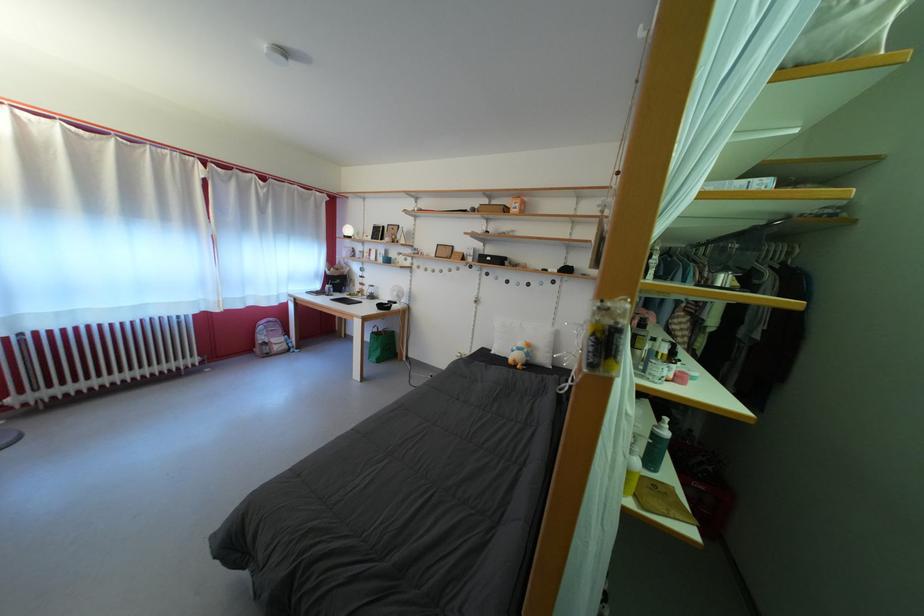
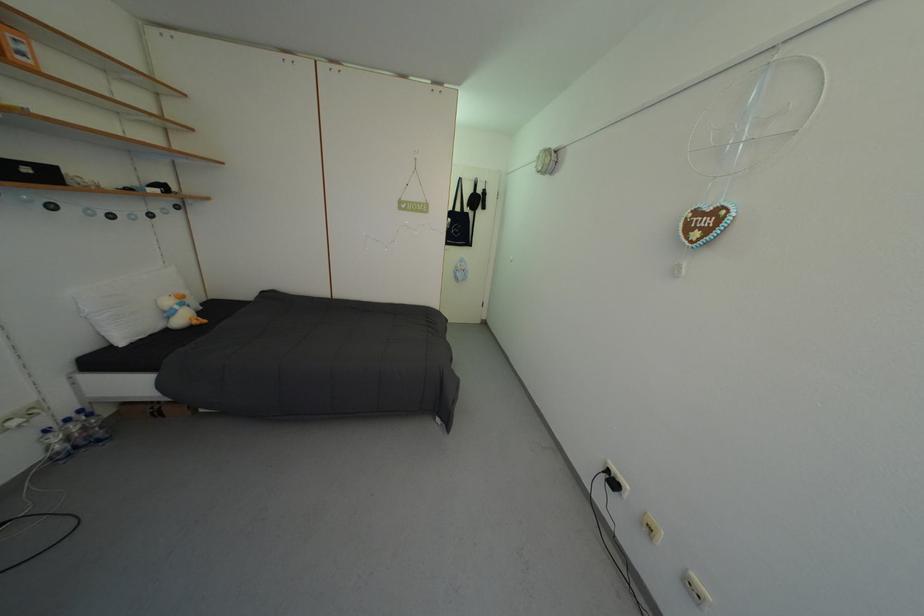
Find the pixel in the second image that matches pixel 524 354 in the first image.

(186, 313)